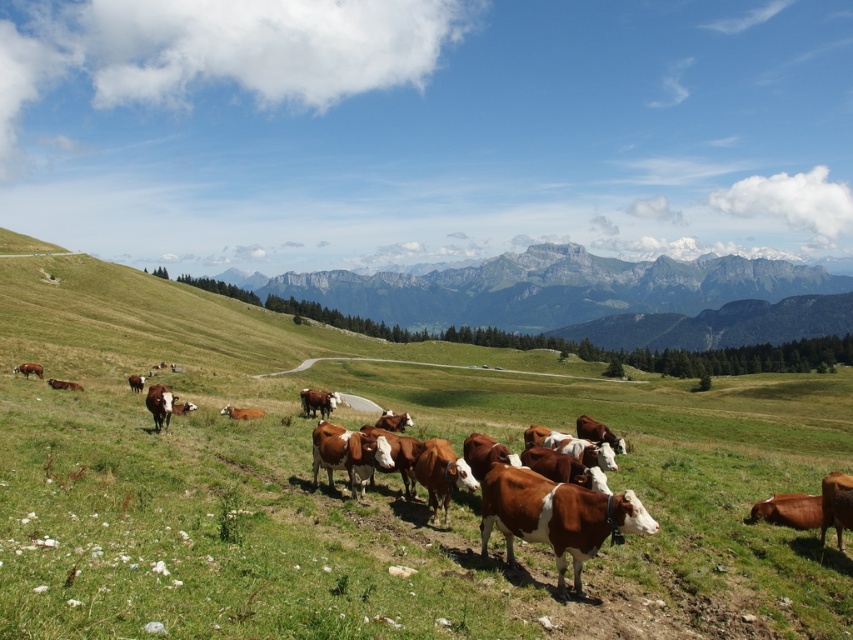
You are standing at point A which is located at coordinates [375,483]. Looking around, what do you see immediately around you?

You are standing in the green grassy field at center.

You are standing at the base of the mountains and want to reach the green grassy field at center. Which direction should you walk to get there?

The green grassy field at center is located at point coordinates which would be in the middle of the image. Since you are at the base of the mountains, you should walk towards the center of the image to reach the green grassy field at center.